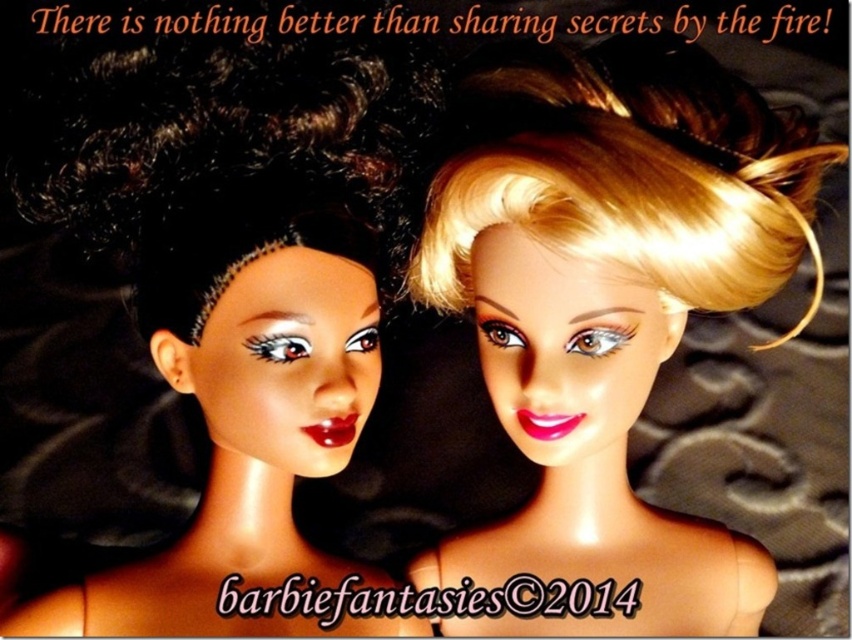
Question: Which point is closer to the camera?

Choices:
 (A) matte black doll at left
 (B) shiny blonde hair at center

Answer: (B)

Question: Does shiny blonde hair at center have a smaller size compared to matte black doll at left?

Choices:
 (A) no
 (B) yes

Answer: (A)

Question: Is the position of shiny blonde hair at center less distant than that of matte black doll at left?

Choices:
 (A) yes
 (B) no

Answer: (A)

Question: Among these objects, which one is farthest from the camera?

Choices:
 (A) matte black doll at left
 (B) shiny blonde hair at center

Answer: (A)

Question: Is shiny blonde hair at center wider than matte black doll at left?

Choices:
 (A) no
 (B) yes

Answer: (A)

Question: Among these objects, which one is nearest to the camera?

Choices:
 (A) shiny blonde hair at center
 (B) matte black doll at left

Answer: (A)